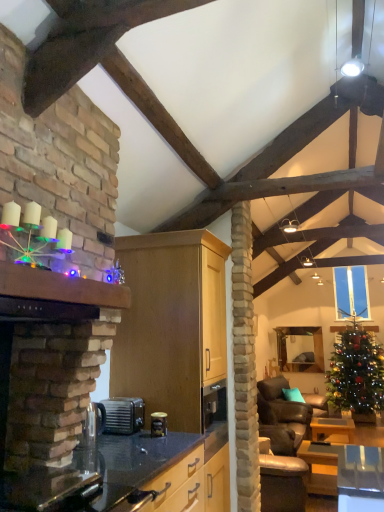
At what (x,y) coordinates should I click in order to perform the action: click on clear glass carafe at lower left, which appears as the third appliance when viewed from the right. Please return your answer as a coordinate pair (x, y). Looking at the image, I should click on (92, 424).

This screenshot has height=512, width=384. Find the location of `wooden table at lower right, the second table when ordered from back to front`. wooden table at lower right, the second table when ordered from back to front is located at coordinates (320, 464).

In order to face wooden table at lower right, which ranks as the first table in front-to-back order, should I rotate leftwards or rightwards?

You should look right and rotate roughly 17.849 degrees.

The width and height of the screenshot is (384, 512). I want to click on metallic black toaster at center, marked as the 3th appliance in a front-to-back arrangement, so click(x=123, y=415).

Consider the image. Is metallic black toaster at center, marked as the 3th appliance in a front-to-back arrangement, situated inside black granite countertop at center or outside?

metallic black toaster at center, marked as the 3th appliance in a front-to-back arrangement, is outside black granite countertop at center.

Which object is closer to the camera taking this photo, metallic black toaster at center, positioned as the first appliance in back-to-front order, or black granite countertop at center?

black granite countertop at center is more forward.

Identify the location of countertop on the right of the metallic black toaster at center, positioned as the first appliance in back-to-front order. (127, 477).

From a real-world perspective, is leather couch at lower right physically below wooden mantle at upper left?

Indeed, from a real-world perspective, leather couch at lower right is positioned beneath wooden mantle at upper left.

Is leather couch at lower right located outside wooden mantle at upper left?

leather couch at lower right lies outside wooden mantle at upper left's area.

How different are the orientations of leather couch at lower right and wooden mantle at upper left in degrees?

12.6 degrees.

Between clear glass window at upper center and leather couch at lower right, which one is positioned behind?

Positioned behind is clear glass window at upper center.

From a real-world perspective, is clear glass window at upper center on leather couch at lower right?

Yes, from a real-world perspective, clear glass window at upper center is above leather couch at lower right.

In the scene shown: Is clear glass window at upper center oriented towards leather couch at lower right?

No, clear glass window at upper center is not facing towards leather couch at lower right.

Is clear glass window at upper center bigger than leather couch at lower right?

Actually, clear glass window at upper center might be smaller than leather couch at lower right.

Is metallic canister at center, placed as the 2th appliance when sorted from front to back, thinner than wooden table at lower right, which is the second table in front-to-back order?

Indeed, metallic canister at center, placed as the 2th appliance when sorted from front to back, has a lesser width compared to wooden table at lower right, which is the second table in front-to-back order.

Is metallic canister at center, marked as the 2th appliance in a back-to-front arrangement, looking in the opposite direction of wooden table at lower right, which is the second table in front-to-back order?

No, metallic canister at center, marked as the 2th appliance in a back-to-front arrangement,'s orientation is not away from wooden table at lower right, which is the second table in front-to-back order.

In the scene shown: Is metallic canister at center, placed as the 2th appliance when sorted from front to back, positioned beyond the bounds of wooden table at lower right, which is the second table in front-to-back order?

metallic canister at center, placed as the 2th appliance when sorted from front to back, lies outside wooden table at lower right, which is the second table in front-to-back order,'s area.

Considering the sizes of metallic canister at center, placed as the 2th appliance when sorted from front to back, and wooden table at lower right, which is the second table in front-to-back order, in the image, is metallic canister at center, placed as the 2th appliance when sorted from front to back, taller or shorter than wooden table at lower right, which is the second table in front-to-back order,?

In the image, metallic canister at center, placed as the 2th appliance when sorted from front to back, appears to be shorter than wooden table at lower right, which is the second table in front-to-back order.

Is wooden table at lower right, the second table when ordered from back to front, looking in the opposite direction of leather couch at lower right?

wooden table at lower right, the second table when ordered from back to front, is not turned away from leather couch at lower right.

Which of these two, wooden table at lower right, which ranks as the first table in front-to-back order, or leather couch at lower right, is wider?

Wider between the two is leather couch at lower right.

Considering the relative positions of wooden table at lower right, which ranks as the first table in front-to-back order, and leather couch at lower right in the image provided, is wooden table at lower right, which ranks as the first table in front-to-back order, to the left or to the right of leather couch at lower right?

From the image, it's evident that wooden table at lower right, which ranks as the first table in front-to-back order, is to the left of leather couch at lower right.

How different are the orientations of wooden table at lower right, which ranks as the first table in front-to-back order, and leather couch at lower right in degrees?

There is a 10.6-degree angle between the facing directions of wooden table at lower right, which ranks as the first table in front-to-back order, and leather couch at lower right.

Which of these two, leather couch at lower right or metallic black toaster at center, marked as the 3th appliance in a front-to-back arrangement, is bigger?

Bigger between the two is leather couch at lower right.

You are a GUI agent. You are given a task and a screenshot of the screen. Output one action in this format:
    pyautogui.click(x=<x>, y=<y>)
    Task: Click on the 1st appliance above the leather couch at lower right (from the image's perspective)
    This screenshot has width=384, height=512.
    Given the screenshot: What is the action you would take?
    pyautogui.click(x=123, y=415)

From a real-world perspective, which is physically below, leather couch at lower right or metallic black toaster at center, arranged as the 2th appliance when viewed from the left?

In real-world perspective, leather couch at lower right is lower.

How different are the orientations of black granite countertop at center and clear glass window at upper center in degrees?

The angular difference between black granite countertop at center and clear glass window at upper center is 91.1 degrees.

Is black granite countertop at center looking in the opposite direction of clear glass window at upper center?

black granite countertop at center does not have its back to clear glass window at upper center.

Which is more to the left, black granite countertop at center or clear glass window at upper center?

black granite countertop at center.

Is black granite countertop at center far from clear glass window at upper center?

Yes, black granite countertop at center and clear glass window at upper center are located far from each other.

The height and width of the screenshot is (512, 384). Find the location of `countertop located on the right of metallic black toaster at center, which is counted as the second appliance, starting from the right`. countertop located on the right of metallic black toaster at center, which is counted as the second appliance, starting from the right is located at coordinates (127, 477).

This screenshot has width=384, height=512. Identify the location of mantle that is above the leather couch at lower right (from the image's perspective). (60, 287).

From the image, which object appears to be nearer to wooden table at lower right, which is the second table in front-to-back order, leather couch at lower right or metallic black toaster at center, positioned as the first appliance in back-to-front order?

leather couch at lower right is positioned closer to the anchor wooden table at lower right, which is the second table in front-to-back order.

Which object lies nearer to the anchor point clear glass carafe at lower left, which appears as the third appliance when viewed from the right, leather couch at lower right or clear glass window at upper center?

Among the two, leather couch at lower right is located nearer to clear glass carafe at lower left, which appears as the third appliance when viewed from the right.

Looking at this image, considering their positions, is matte wood cabinet at center positioned closer to clear glass carafe at lower left, which appears as the third appliance when viewed from the right, than green glossy christmas tree at right?

matte wood cabinet at center.

Which object lies nearer to the anchor point metallic canister at center, marked as the 3th appliance in a left-to-right arrangement, green glossy christmas tree at right or leather couch at lower right?

Based on the image, leather couch at lower right appears to be nearer to metallic canister at center, marked as the 3th appliance in a left-to-right arrangement.

From the image, which object appears to be nearer to leather couch at lower right, metallic canister at center, placed as the 2th appliance when sorted from front to back, or green glossy christmas tree at right?

green glossy christmas tree at right.

Based on the photo, estimate the real-world distances between objects in this image. Which object is closer to matte wood cabinet at center, clear glass window at upper center or metallic black toaster at center, marked as the 3th appliance in a front-to-back arrangement?

metallic black toaster at center, marked as the 3th appliance in a front-to-back arrangement.

From the image, which object appears to be nearer to clear glass carafe at lower left, which is the first appliance from front to back, wooden table at lower right, the second table when ordered from back to front, or matte wood cabinet at center?

matte wood cabinet at center lies closer to clear glass carafe at lower left, which is the first appliance from front to back, than the other object.

Based on their spatial positions, is matte wood cabinet at center or wooden table at lower right, which ranks as the 1th table in back-to-front order, closer to leather couch at lower right?

Based on the image, wooden table at lower right, which ranks as the 1th table in back-to-front order, appears to be nearer to leather couch at lower right.

Identify the location of appliance located between black granite countertop at center and metallic canister at center, marked as the 2th appliance in a back-to-front arrangement, in the depth direction. The image size is (384, 512). (92, 424).

The height and width of the screenshot is (512, 384). In order to click on studio couch between wooden table at lower right, which is the second table in front-to-back order, and green glossy christmas tree at right from front to back in this screenshot , I will do `click(284, 415)`.

I want to click on cabinetry between clear glass carafe at lower left, which ranks as the 1th appliance in left-to-right order, and clear glass window at upper center from front to back, so click(173, 326).

Where is `studio couch positioned between clear glass carafe at lower left, the third appliance when ordered from back to front, and green glossy christmas tree at right from near to far`? This screenshot has width=384, height=512. studio couch positioned between clear glass carafe at lower left, the third appliance when ordered from back to front, and green glossy christmas tree at right from near to far is located at coordinates (284, 415).